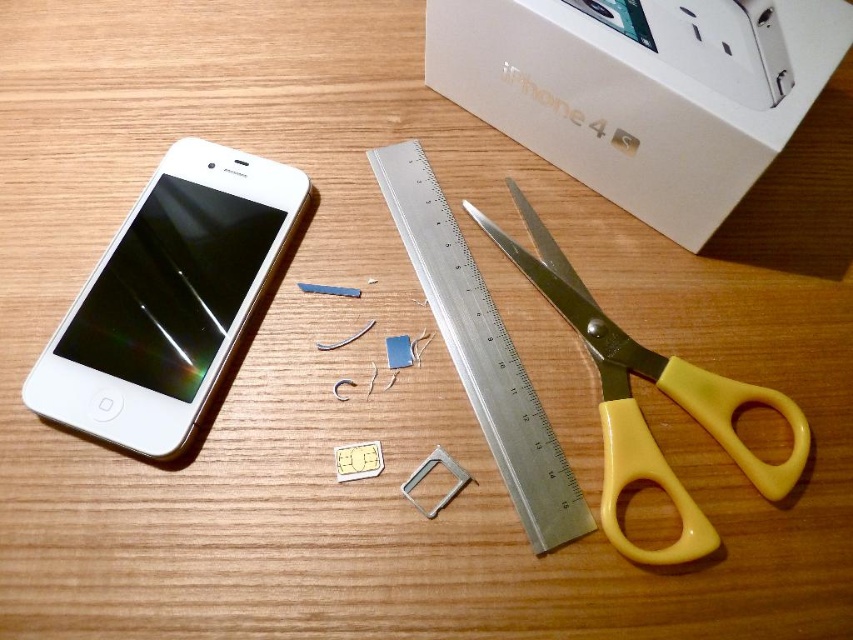
Question: Can you confirm if silver metallic ruler at center is thinner than yellow plastic scissors at right?

Choices:
 (A) no
 (B) yes

Answer: (B)

Question: Which object appears farthest from the camera in this image?

Choices:
 (A) yellow plastic scissors at right
 (B) white matte smartphone at left

Answer: (B)

Question: Considering the real-world distances, which object is farthest from the white cardboard box at upper center?

Choices:
 (A) yellow plastic scissors at right
 (B) white matte smartphone at left
 (C) silver metallic ruler at center

Answer: (B)

Question: Does white cardboard box at upper center appear on the right side of silver metallic ruler at center?

Choices:
 (A) yes
 (B) no

Answer: (A)

Question: Is white cardboard box at upper center bigger than white matte smartphone at left?

Choices:
 (A) no
 (B) yes

Answer: (B)

Question: Which point is closer to the camera taking this photo?

Choices:
 (A) (148, 266)
 (B) (494, 108)

Answer: (A)